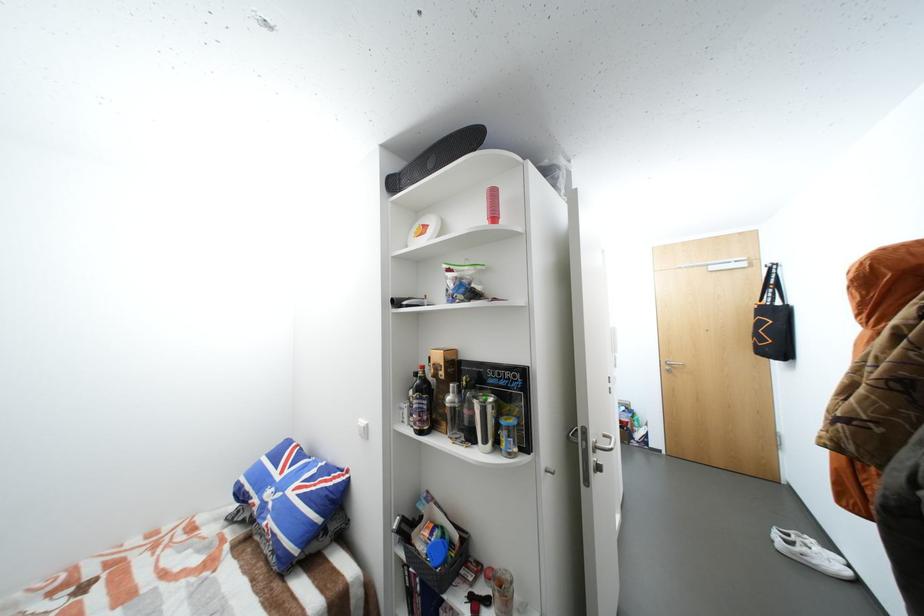
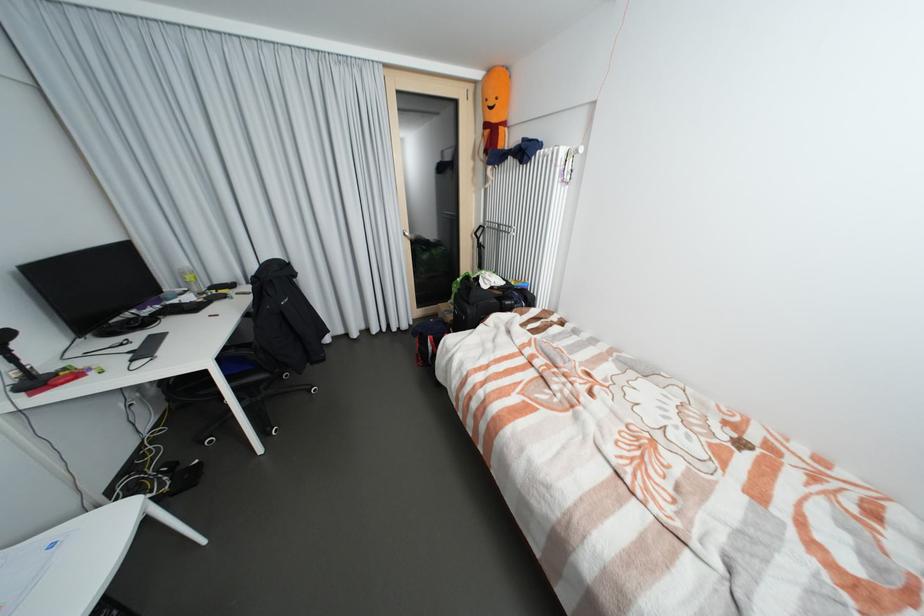
First-person continuous shooting, in which direction is the camera rotating?

The camera's rotation is toward left-down.